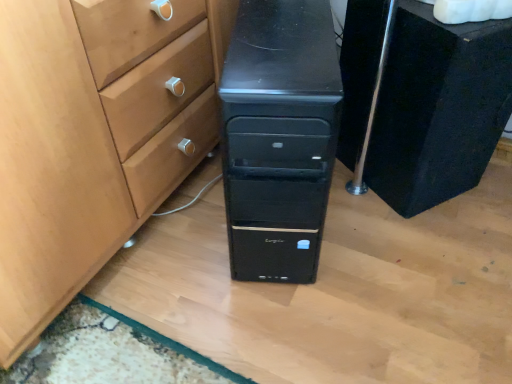
The width and height of the screenshot is (512, 384). I want to click on vacant area that lies between black matte chest of drawers at center, which appears as the second chest of drawers when viewed from the right, and black matte chest of drawers at center, which appears as the first chest of drawers when viewed from the right, so click(x=365, y=230).